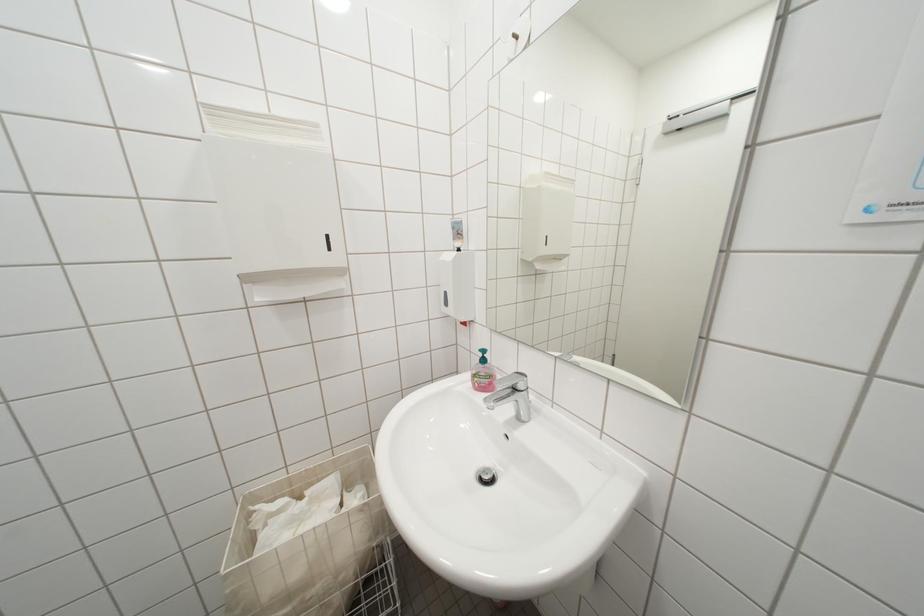
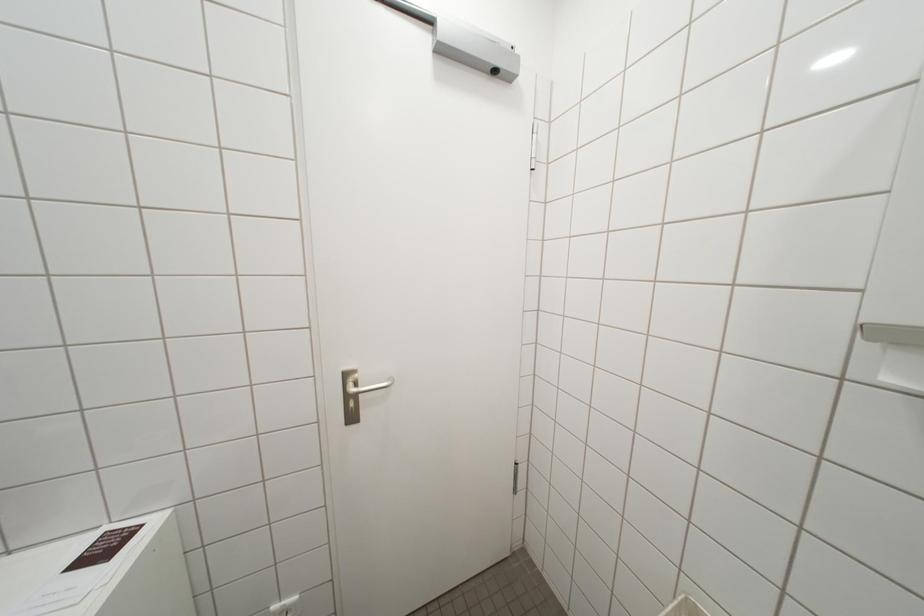
Question: How did the camera likely rotate?

Choices:
 (A) Left
 (B) Right
 (C) Up
 (D) Down

Answer: (A)